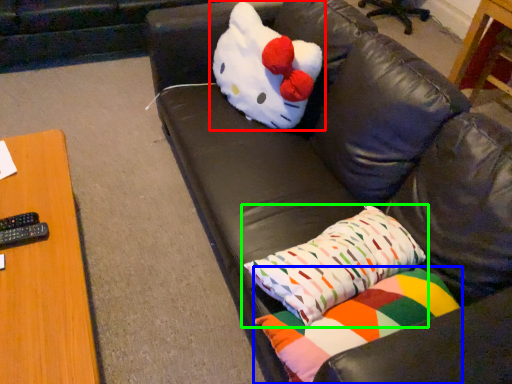
Question: Which object is the farthest from toy (highlighted by a red box)? Choose among these: pillow (highlighted by a blue box) or pillow (highlighted by a green box).

Choices:
 (A) pillow
 (B) pillow

Answer: (A)